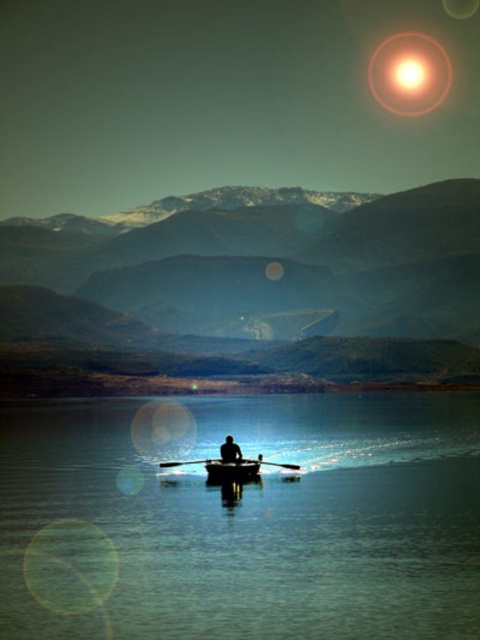
Question: Considering the relative positions of glowing orange orb at upper right and wooden canoe at center in the image provided, where is glowing orange orb at upper right located with respect to wooden canoe at center?

Choices:
 (A) below
 (B) above

Answer: (B)

Question: Which point appears closest to the camera in this image?

Choices:
 (A) (236, 477)
 (B) (412, 38)

Answer: (A)

Question: Can you confirm if green matte mountain at center is positioned to the left of wooden canoe at center?

Choices:
 (A) no
 (B) yes

Answer: (A)

Question: Which of the following is the closest to the observer?

Choices:
 (A) click(230, 454)
 (B) click(232, 461)
 (C) click(476, 483)

Answer: (B)

Question: Which object appears closest to the camera in this image?

Choices:
 (A) black plastic paddle at center
 (B) transparent blue water at center
 (C) black matte person at center

Answer: (B)

Question: Is transparent blue water at center above green matte mountain at center?

Choices:
 (A) no
 (B) yes

Answer: (A)